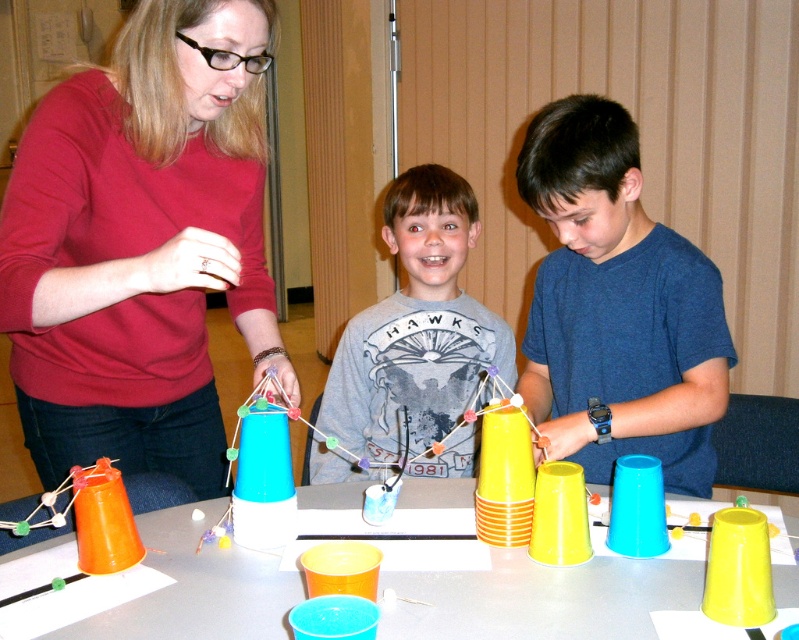
Question: Which object is the closest to the gray matte shirt at center?

Choices:
 (A) blue matte cup at center
 (B) smooth plastic cups at center
 (C) matte red sweater at center

Answer: (A)

Question: Estimate the real-world distances between objects in this image. Which object is closer to the gray matte shirt at center?

Choices:
 (A) matte red sweater at center
 (B) blue matte cup at center
 (C) smooth plastic cups at center

Answer: (B)

Question: Does matte red sweater at center appear under gray matte shirt at center?

Choices:
 (A) no
 (B) yes

Answer: (A)

Question: Is blue matte cup at center positioned before smooth plastic cups at center?

Choices:
 (A) yes
 (B) no

Answer: (B)

Question: Which of these objects is positioned closest to the gray matte shirt at center?

Choices:
 (A) blue matte cup at center
 (B) smooth plastic cups at center

Answer: (A)

Question: Can you confirm if matte red sweater at center is positioned above smooth plastic cups at center?

Choices:
 (A) yes
 (B) no

Answer: (A)